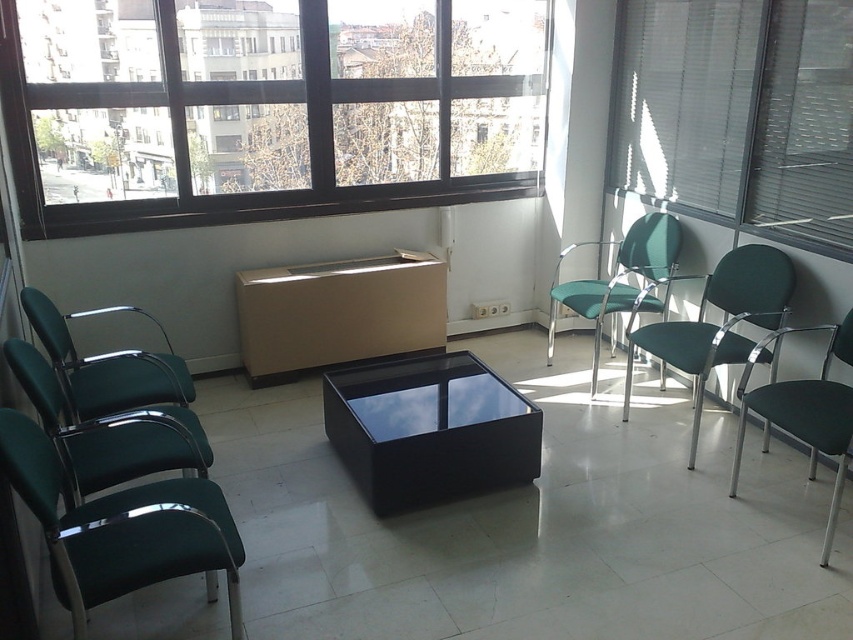
You are standing in the center of the modern waiting room and want to sit down. Which direction should you walk to reach the green fabric chair at right?

You should walk to the right to reach the green fabric chair at right since it is located at point (722, 321), which is to the right side of the room.

You are standing in the modern waiting room described. You see a point marked at coordinates (106, 364). Which object does this point correspond to?

The point at coordinates (106, 364) corresponds to the matte green chair at left.